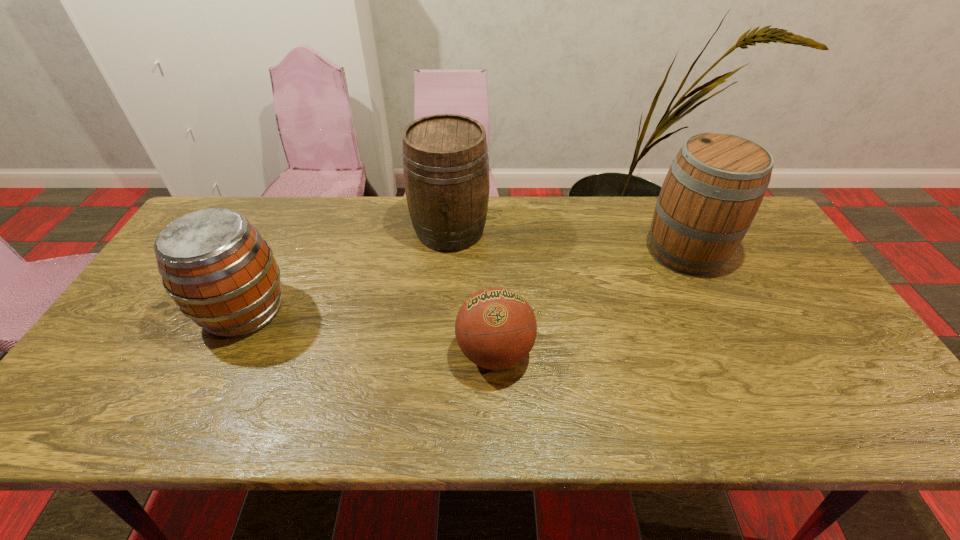
Locate an element on the screen. The image size is (960, 540). free region that satisfies the following two spatial constraints: 1. on the side of the rightmost cider near the bung hole; 2. on the left side of the second cider from left to right is located at coordinates (448, 252).

Where is `vacant position in the image that satisfies the following two spatial constraints: 1. on the side of the basketball near the bung hole; 2. on the left side of the second cider from left to right`? This screenshot has width=960, height=540. vacant position in the image that satisfies the following two spatial constraints: 1. on the side of the basketball near the bung hole; 2. on the left side of the second cider from left to right is located at coordinates (441, 352).

Find the location of a particular element. This screenshot has height=540, width=960. vacant space that satisfies the following two spatial constraints: 1. on the front side of the shortest object; 2. on the right side of the shortest cider is located at coordinates (224, 352).

Locate an element on the screen. This screenshot has width=960, height=540. free point that satisfies the following two spatial constraints: 1. on the side of the rightmost cider near the bung hole; 2. on the right side of the second cider from right to left is located at coordinates (448, 252).